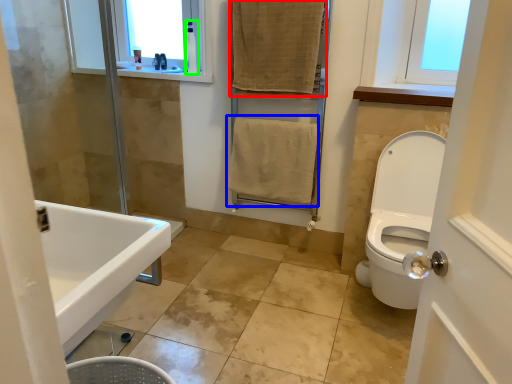
Question: Based on their relative distances, which object is farther from bath towel (highlighted by a red box)? Choose from bath towel (highlighted by a blue box) and toiletry (highlighted by a green box).

Choices:
 (A) bath towel
 (B) toiletry

Answer: (B)